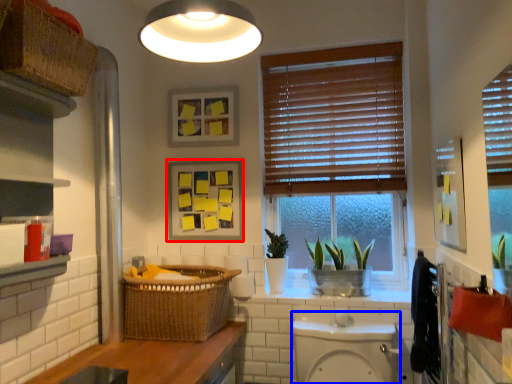
Question: Which object appears farthest to the camera in this image, picture frame (highlighted by a red box) or toilet bowl (highlighted by a blue box)?

Choices:
 (A) picture frame
 (B) toilet bowl

Answer: (A)